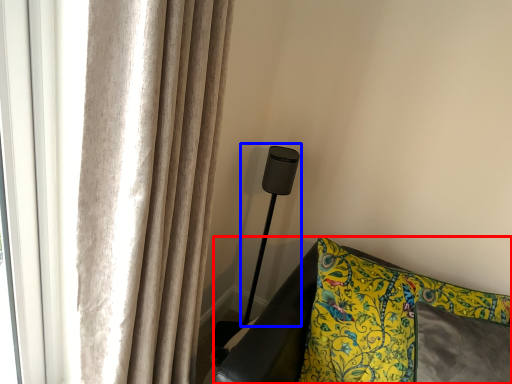
Question: Which of the following is the farthest to the observer, furniture (highlighted by a red box) or table lamp (highlighted by a blue box)?

Choices:
 (A) furniture
 (B) table lamp

Answer: (B)